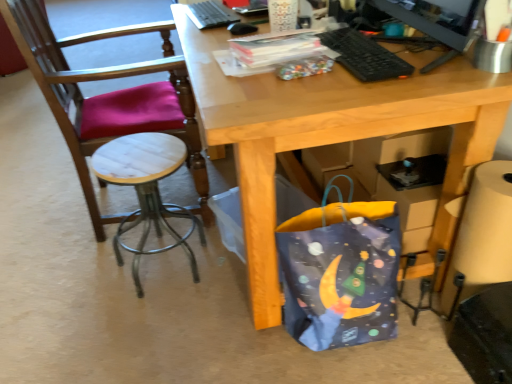
You are a GUI agent. You are given a task and a screenshot of the screen. Output one action in this format:
    pyautogui.click(x=<x>, y=<y>)
    Task: Click on the vacant space that's between white marble stool at left and blue fabric bag at lower right
    Image resolution: width=512 pixels, height=384 pixels.
    Given the screenshot: What is the action you would take?
    pyautogui.click(x=211, y=313)